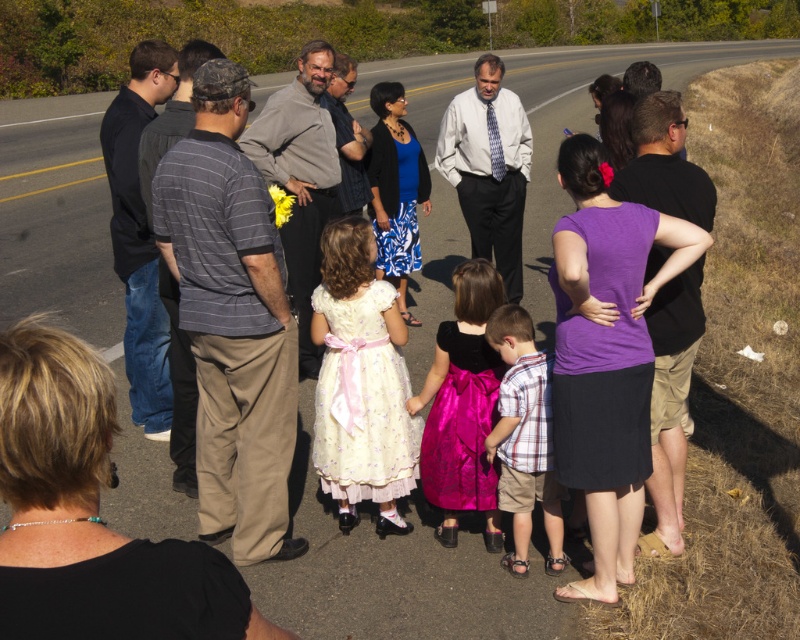
Question: Is plaid cotton shirt at center closer to the viewer compared to gray striped shirt at center?

Choices:
 (A) yes
 (B) no

Answer: (A)

Question: Among these objects, which one is nearest to the camera?

Choices:
 (A) pink satin dress at center
 (B) striped cotton shirt at left

Answer: (B)

Question: From the image, what is the correct spatial relationship of striped cotton shirt at center in relation to light gray shirt at center?

Choices:
 (A) above
 (B) below

Answer: (B)

Question: Which point is farther to the camera?

Choices:
 (A) gray sweater at center
 (B) black cotton shirt at left
 (C) white lace dress at center

Answer: (A)

Question: Which point appears farthest from the camera in this image?

Choices:
 (A) (352, 179)
 (B) (380, 422)
 (C) (576, 188)
 (D) (666, 474)

Answer: (A)

Question: Is black cotton shirt at right thinner than pink satin dress at center?

Choices:
 (A) yes
 (B) no

Answer: (B)